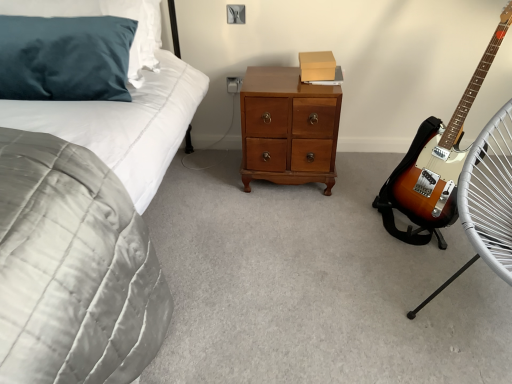
Question: Would you say shiny brown wooden chest of drawers at center is outside teal velvet pillow at upper left?

Choices:
 (A) yes
 (B) no

Answer: (A)

Question: Is shiny brown wooden chest of drawers at center closer to camera compared to teal velvet pillow at upper left?

Choices:
 (A) yes
 (B) no

Answer: (B)

Question: Is the position of shiny brown wooden chest of drawers at center more distant than that of teal velvet pillow at upper left?

Choices:
 (A) yes
 (B) no

Answer: (A)

Question: Is shiny brown wooden chest of drawers at center not near teal velvet pillow at upper left?

Choices:
 (A) yes
 (B) no

Answer: (B)

Question: From a real-world perspective, is shiny brown wooden chest of drawers at center below teal velvet pillow at upper left?

Choices:
 (A) yes
 (B) no

Answer: (A)

Question: Is shiny brown wooden chest of drawers at center bigger than teal velvet pillow at upper left?

Choices:
 (A) yes
 (B) no

Answer: (B)

Question: Is shiny brown wooden chest of drawers at center behind white plastic electric outlet at center?

Choices:
 (A) yes
 (B) no

Answer: (B)

Question: Is shiny brown wooden chest of drawers at center positioned with its back to white plastic electric outlet at center?

Choices:
 (A) yes
 (B) no

Answer: (B)

Question: From a real-world perspective, is shiny brown wooden chest of drawers at center on top of white plastic electric outlet at center?

Choices:
 (A) no
 (B) yes

Answer: (A)

Question: Is shiny brown wooden chest of drawers at center outside white plastic electric outlet at center?

Choices:
 (A) no
 (B) yes

Answer: (B)

Question: Does shiny brown wooden chest of drawers at center appear on the right side of white plastic electric outlet at center?

Choices:
 (A) yes
 (B) no

Answer: (A)

Question: Could you tell me if shiny brown wooden chest of drawers at center is turned towards white plastic electric outlet at center?

Choices:
 (A) yes
 (B) no

Answer: (B)

Question: Can you confirm if velvet grey quilt at left is positioned to the right of shiny brown wooden chest of drawers at center?

Choices:
 (A) yes
 (B) no

Answer: (B)